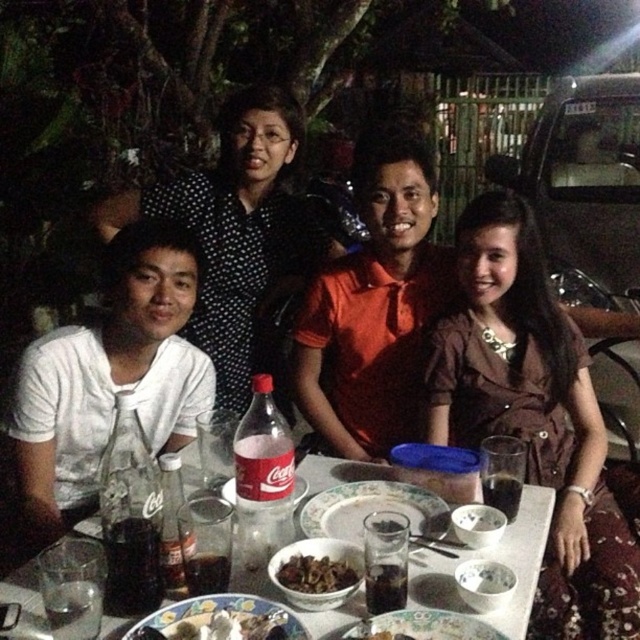
Consider the image. Is brown satin dress at center above matte ceramic platter at center?

Indeed, brown satin dress at center is positioned over matte ceramic platter at center.

Is brown satin dress at center bigger than matte ceramic platter at center?

Yes, brown satin dress at center is bigger than matte ceramic platter at center.

Does point (484, 324) lie behind point (172, 611)?

Yes, it is.

Where is `brown satin dress at center`? brown satin dress at center is located at coordinates (534, 416).

Does matte plastic platter at center have a smaller size compared to matte ceramic platter at center?

Actually, matte plastic platter at center might be larger than matte ceramic platter at center.

Is matte plastic platter at center to the left of matte ceramic platter at center from the viewer's perspective?

No, matte plastic platter at center is not to the left of matte ceramic platter at center.

Locate an element on the screen. This screenshot has height=640, width=640. matte plastic platter at center is located at coordinates (371, 509).

Is white matte bowl at center shorter than translucent glass plate at center?

Yes.

Which is below, white matte bowl at center or translucent glass plate at center?

Positioned lower is white matte bowl at center.

From the picture: Who is more forward, (484, 589) or (300, 492)?

Point (484, 589) is more forward.

Find the location of `white matte bowl at center`. white matte bowl at center is located at coordinates [484, 579].